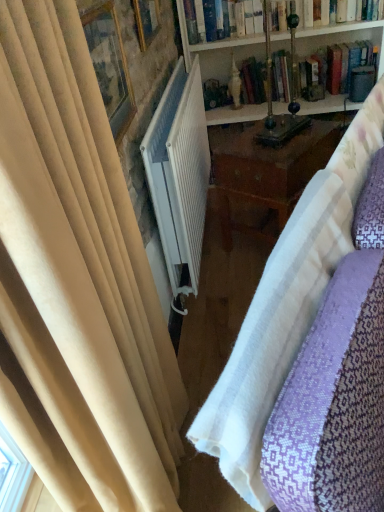
Question: Considering the positions of matte gold picture frame at upper left, which is the first picture frame from front to back, and white wooden bookcase at upper center in the image, is matte gold picture frame at upper left, which is the first picture frame from front to back, wider or thinner than white wooden bookcase at upper center?

Choices:
 (A) wide
 (B) thin

Answer: (B)

Question: Choose the correct answer: Is matte gold picture frame at upper left, which is the second picture frame in top-to-bottom order, inside white wooden bookcase at upper center or outside it?

Choices:
 (A) inside
 (B) outside

Answer: (B)

Question: Considering the real-world distances, which object is closest to the wooden picture frame at upper center, the 1th picture frame from the top?

Choices:
 (A) matte gold picture frame at upper left, which is the second picture frame in top-to-bottom order
 (B) white ribbed radiator at center
 (C) white textured fabric at center
 (D) hardcover book at upper center
 (E) brass table lamp at center

Answer: (B)

Question: Which of these objects is positioned closest to the white textured fabric at center?

Choices:
 (A) white ribbed radiator at center
 (B) hardcover book at upper center
 (C) wooden picture frame at upper center, marked as the 1th picture frame in a back-to-front arrangement
 (D) brass table lamp at center
 (E) white wooden bookcase at upper center

Answer: (A)